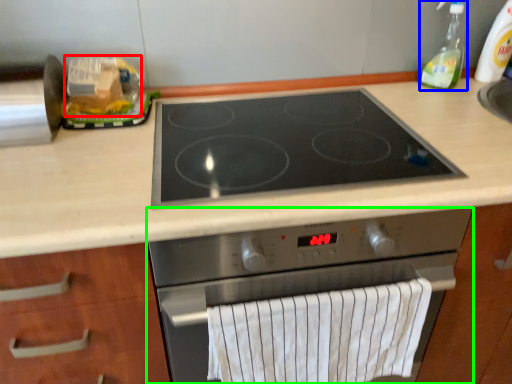
Question: Estimate the real-world distances between objects in this image. Which object is farther from food (highlighted by a red box), soap dispenser (highlighted by a blue box) or kitchen appliance (highlighted by a green box)?

Choices:
 (A) soap dispenser
 (B) kitchen appliance

Answer: (A)